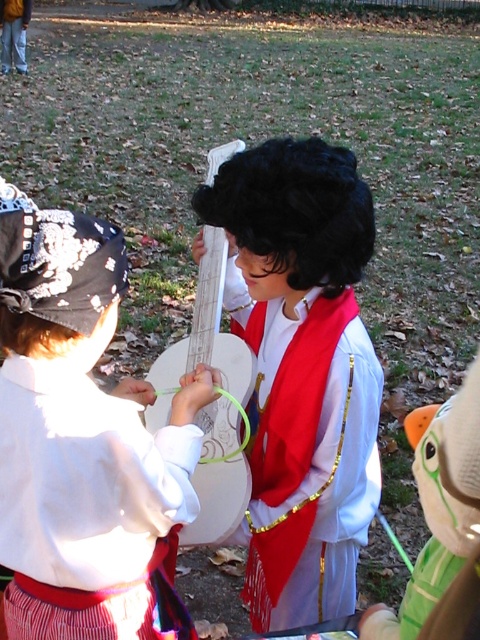
Who is shorter, white cotton shirt at upper left or matte black wig at center?

white cotton shirt at upper left

Does white cotton shirt at upper left have a greater width compared to matte black wig at center?

No.

Which is behind, point (193, 445) or point (243, 221)?

The point (193, 445) is behind.

Image resolution: width=480 pixels, height=640 pixels. What are the coordinates of `white cotton shirt at upper left` in the screenshot? It's located at (83, 440).